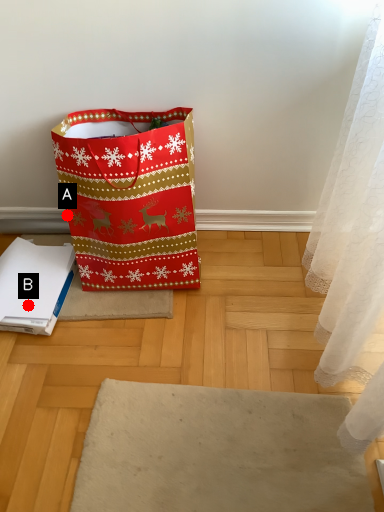
Question: Two points are circled on the image, labeled by A and B beside each circle. Among these points, which one is farthest from the camera?

Choices:
 (A) A is further
 (B) B is further

Answer: (A)